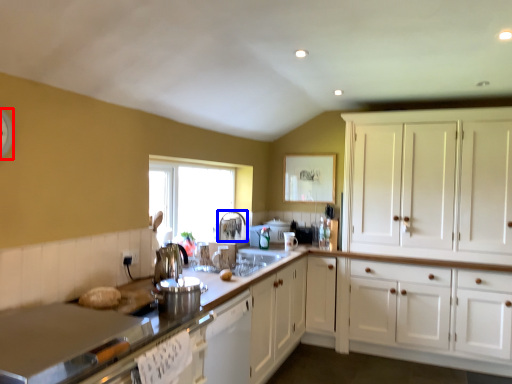
Question: Which point is further to the camera, clock (highlighted by a red box) or faucet (highlighted by a blue box)?

Choices:
 (A) clock
 (B) faucet

Answer: (B)